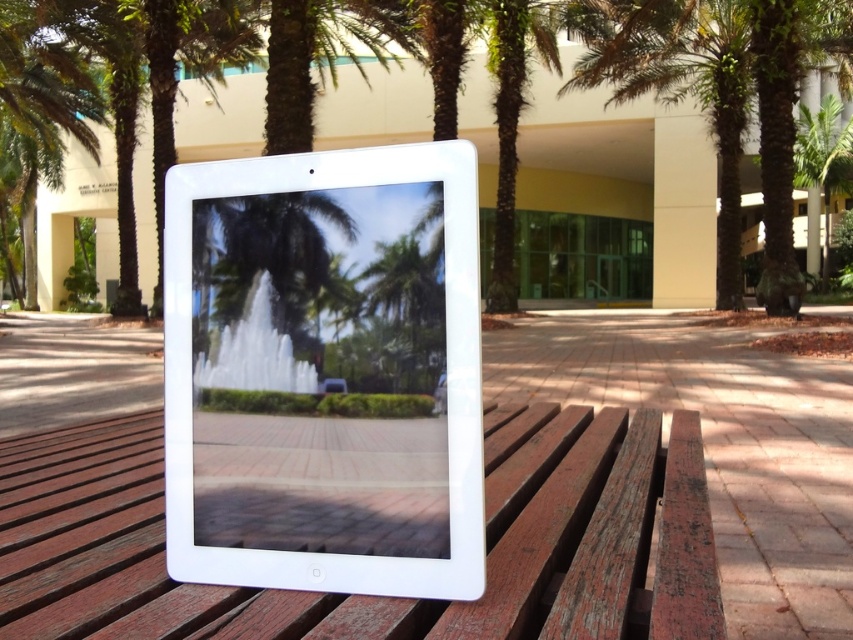
Consider the image. You are a photographer trying to capture the reflection of the fountain in the white glossy tablet at center. Since the tablet is much taller than the wooden picnic table at center, will the reflection of the fountain be larger or smaller compared to the actual fountain?

The white glossy tablet at center is much taller than the wooden picnic table at center, so the reflection of the fountain in the tablet will be larger compared to the actual fountain.

You are sitting at the wooden picnic table at center and want to look at the green leafy palm tree at upper right. In which direction should you turn your head to see it?

You should turn your head to the right because the wooden picnic table at center is to the left of the green leafy palm tree at upper right, so the palm tree is on the right side relative to the picnic table.

You are looking at the tablet which reflects the outdoor scene. There are two points marked on the tablet display at coordinates point (466, 385) and point (822, 124). Which point is closer to you as you view the tablet?

Point (466, 385) is closer to the camera than point (822, 124), so the point at (466, 385) is closer to you as you view the tablet.